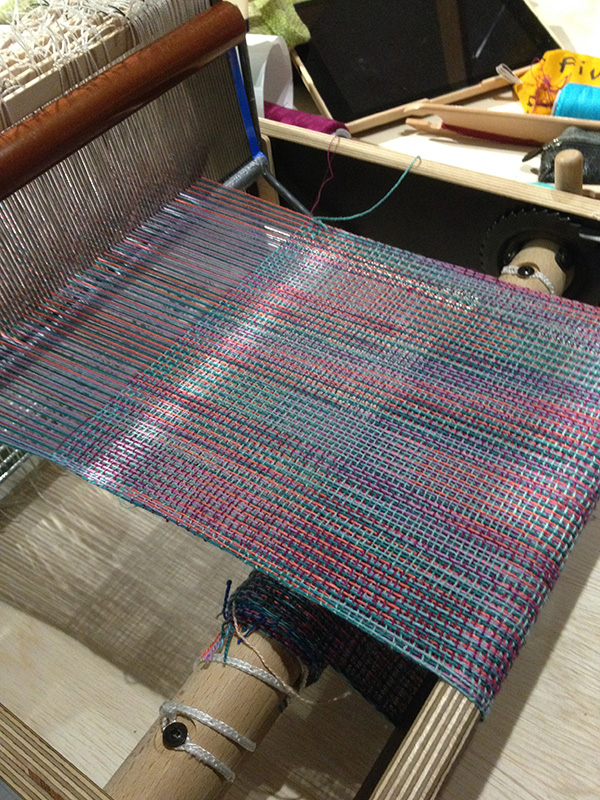
Locate an element on the screen. The height and width of the screenshot is (800, 600). black screw is located at coordinates (180, 730).